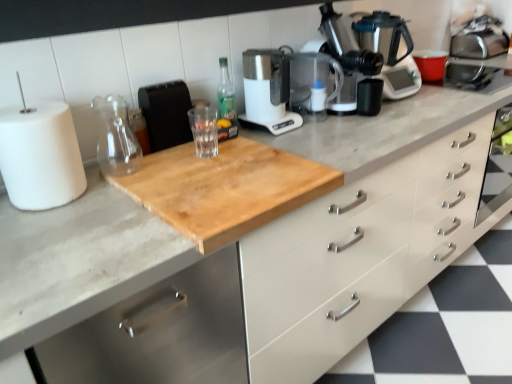
Identify the location of vacant area located to the right-hand side of green glass bottle at center. (288, 131).